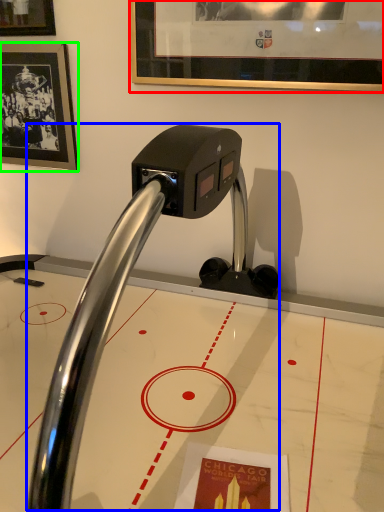
Question: Which is farther away from picture frame (highlighted by a red box)? faucet (highlighted by a blue box) or picture frame (highlighted by a green box)?

Choices:
 (A) faucet
 (B) picture frame

Answer: (A)